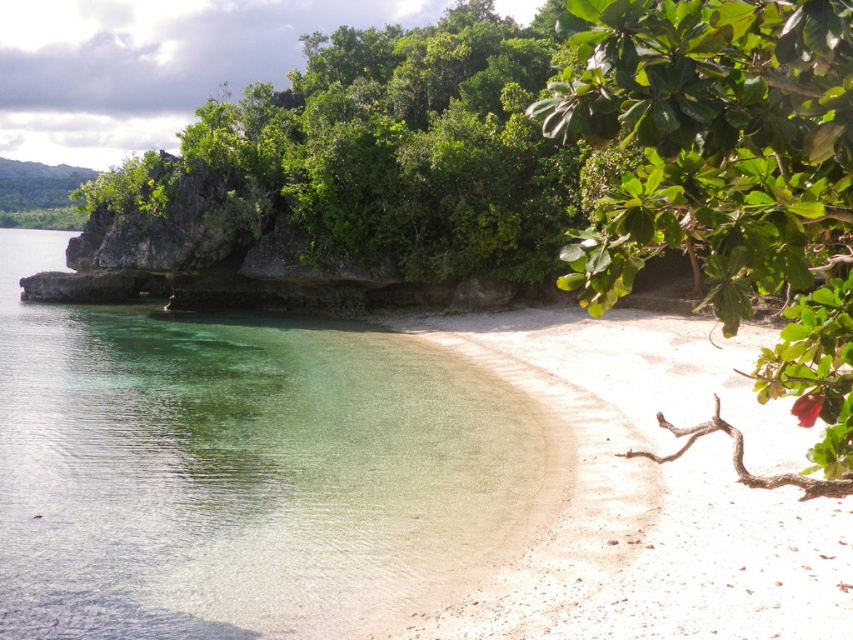
Who is higher up, white sandy beach at lower right or green leafy tree at upper right?

green leafy tree at upper right is higher up.

Is point (527, 621) closer to viewer compared to point (691, 232)?

No, it is behind (691, 232).

Does point (413, 320) come closer to viewer compared to point (596, 289)?

No, (413, 320) is further to viewer.

Find the location of a particular element. The height and width of the screenshot is (640, 853). white sandy beach at lower right is located at coordinates 653,488.

Where is `clear water at lower left`? clear water at lower left is located at coordinates (236, 467).

Who is more distant from viewer, (x=64, y=468) or (x=653, y=125)?

The point (x=64, y=468) is more distant.

Where is `clear water at lower left`? clear water at lower left is located at coordinates (236, 467).

Looking at this image, does green leafy tree at upper right appear under green leafy rock at upper left?

Correct, green leafy tree at upper right is located below green leafy rock at upper left.

Between green leafy tree at upper right and green leafy rock at upper left, which one is positioned higher?

green leafy rock at upper left is higher up.

The width and height of the screenshot is (853, 640). Find the location of `green leafy tree at upper right`. green leafy tree at upper right is located at coordinates (727, 177).

This screenshot has height=640, width=853. In order to click on green leafy tree at upper right in this screenshot , I will do `click(727, 177)`.